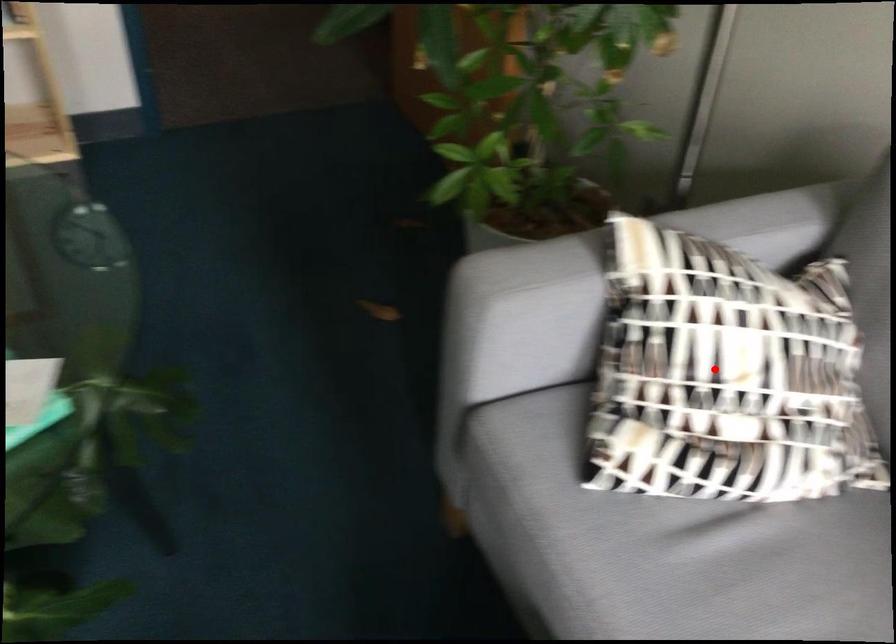
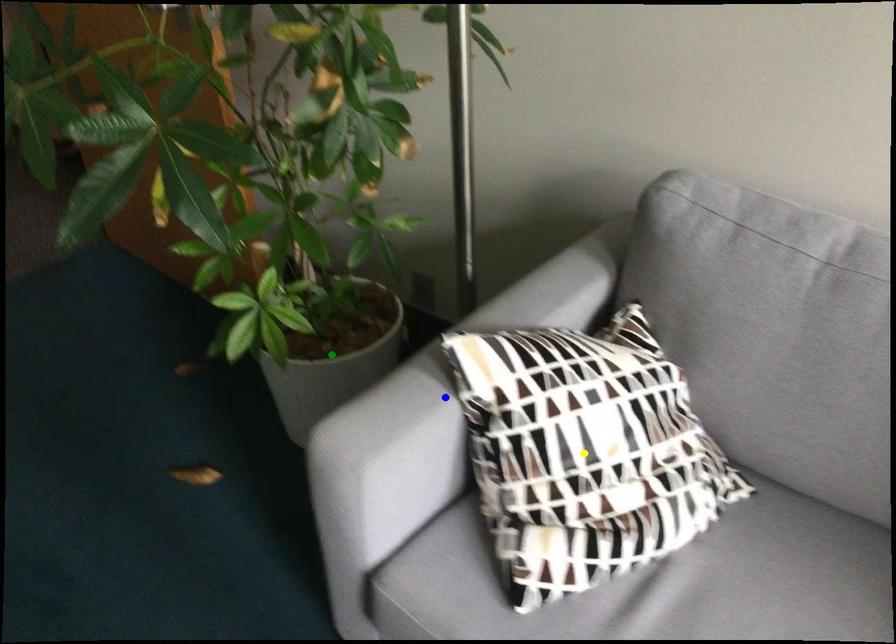
Question: I am providing you with two images of the same scene from different viewpoints. A red point is marked on the first image. You are given multiple points on the second image. In image 2, which mark is for the same physical point as the one in image 1?

Choices:
 (A) blue point
 (B) yellow point
 (C) green point

Answer: (B)